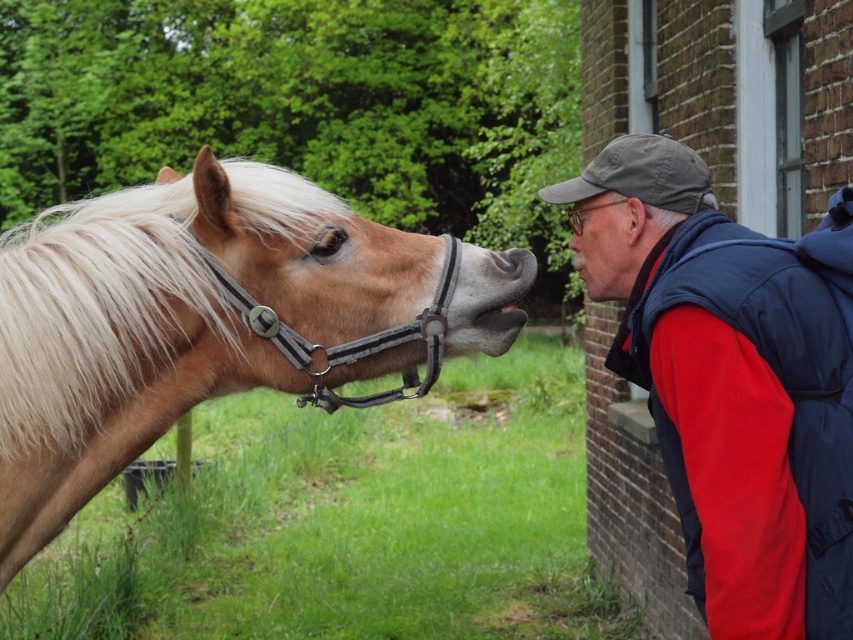
You are a photographer trying to capture a closeup of the matte skin nose at center while ensuring the blue fleece vest at right is visible in the frame. Based on their positions, can you position yourself so that both are in the same shot?

The blue fleece vest at right is below the matte skin nose at center, so yes, you can position yourself to include both in the same shot by framing the image to capture the lower area where the blue fleece vest at right is located while keeping the matte skin nose at center in the upper part of the frame.

You are a photographer setting up a shot of the horse and man. You need to ensure the blonde mane and bridle at left and the matte skin nose at center are both in focus. Given that your camera can only focus on objects within a 15 cm width range, will both objects fit within this range?

The blonde mane and bridle at left is wider than the matte skin nose at center. Since the camera can focus on objects within a 15 cm width range, and the width difference between the two objects is not specified, it is uncertain if both will fit within the range. More information about their exact widths is needed.